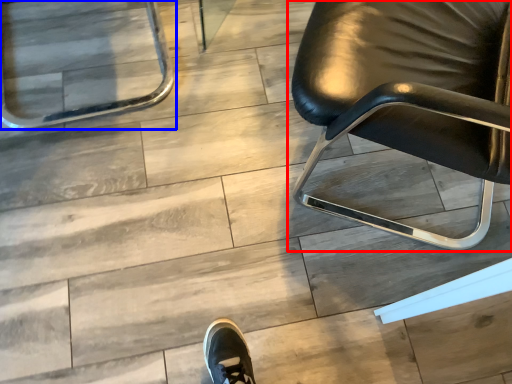
Question: Which object appears closest to the camera in this image, chair (highlighted by a red box) or chair (highlighted by a blue box)?

Choices:
 (A) chair
 (B) chair

Answer: (A)